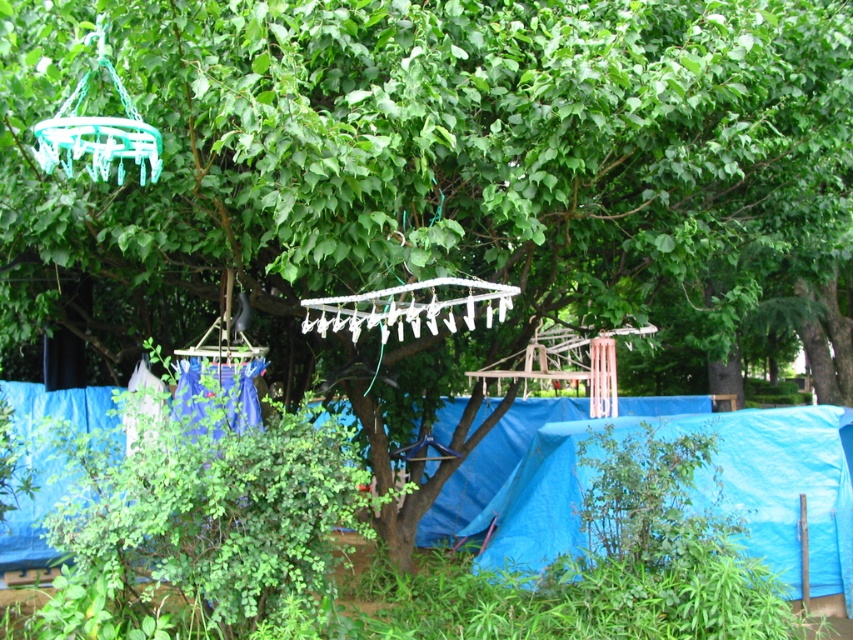
Question: Is blue tarpaulin at center above white plastic clothesline at center?

Choices:
 (A) no
 (B) yes

Answer: (A)

Question: Does blue tarpaulin at lower right have a larger size compared to blue tarpaulin at center?

Choices:
 (A) no
 (B) yes

Answer: (B)

Question: Is the position of blue tarpaulin at center less distant than that of white plastic clothesline at center?

Choices:
 (A) yes
 (B) no

Answer: (B)

Question: Which of the following is the closest to the observer?

Choices:
 (A) white plastic clothesline at center
 (B) blue tarpaulin at center
 (C) blue tarpaulin at lower right

Answer: (A)

Question: Which point is farther from the camera taking this photo?

Choices:
 (A) (497, 400)
 (B) (453, 321)
 (C) (593, 433)

Answer: (A)

Question: Which point is farther from the camera taking this photo?

Choices:
 (A) (457, 324)
 (B) (839, 445)

Answer: (B)